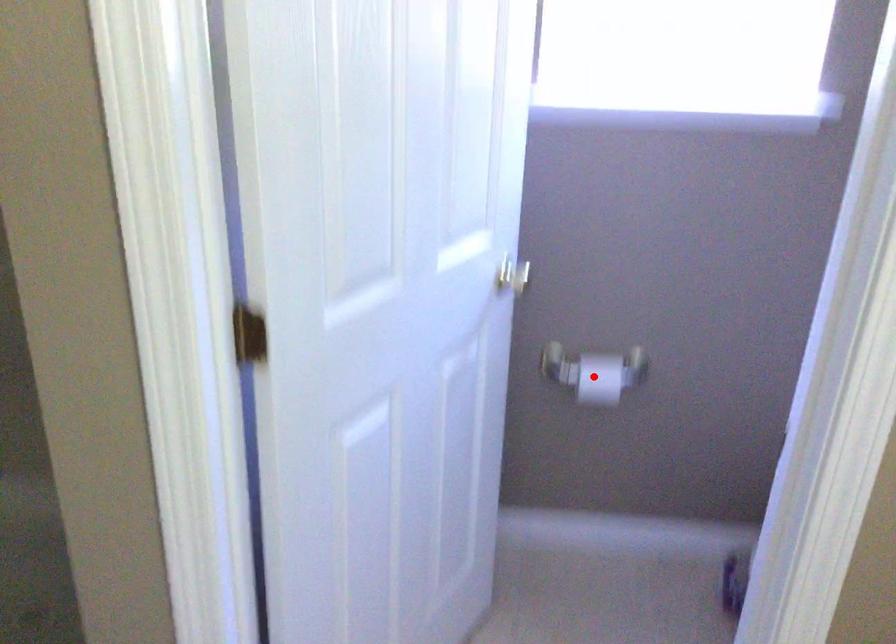
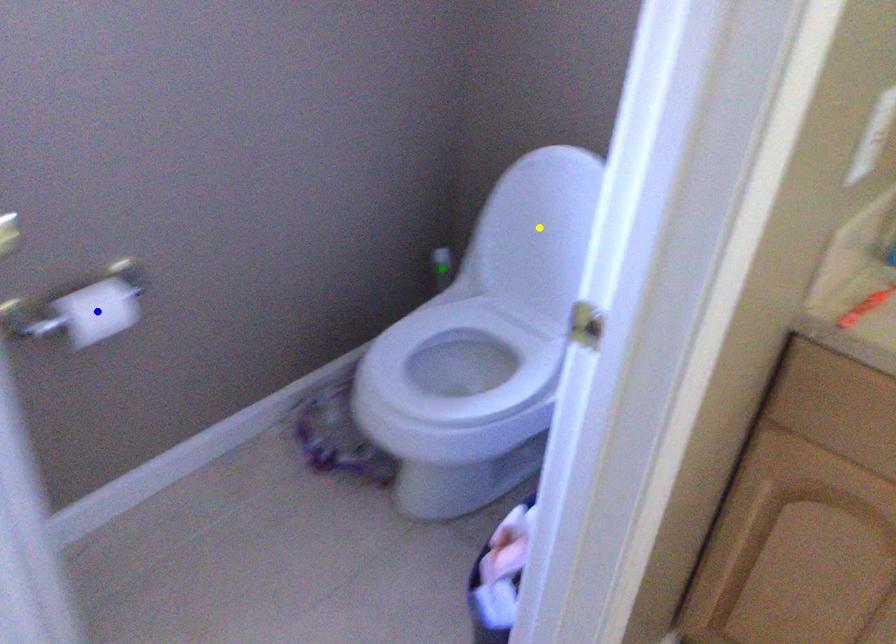
Question: I am providing you with two images of the same scene from different viewpoints. A red point is marked on the first image. You are given multiple points on the second image. In image 2, which mark is for the same physical point as the one in image 1?

Choices:
 (A) yellow point
 (B) blue point
 (C) green point

Answer: (B)